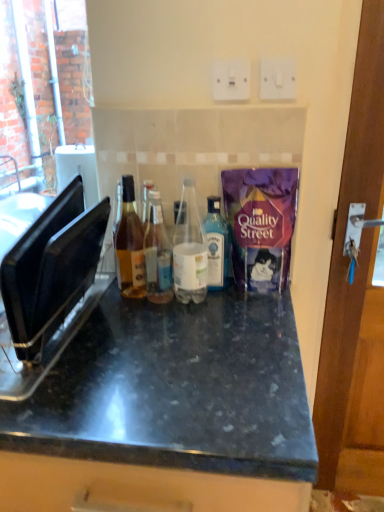
You are a GUI agent. You are given a task and a screenshot of the screen. Output one action in this format:
    pyautogui.click(x=<x>, y=<y>)
    Task: Click on the vacant area that is in front of translucent plastic bottle at center, the 2th bottle from the right
    
    Given the screenshot: What is the action you would take?
    pyautogui.click(x=187, y=334)